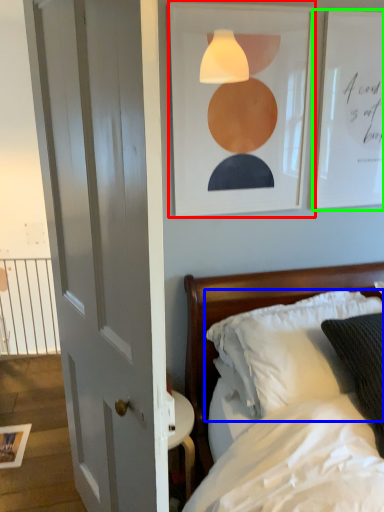
Question: Which object is positioned farthest from picture frame (highlighted by a red box)? Select from pillow (highlighted by a blue box) and picture frame (highlighted by a green box).

Choices:
 (A) pillow
 (B) picture frame

Answer: (A)